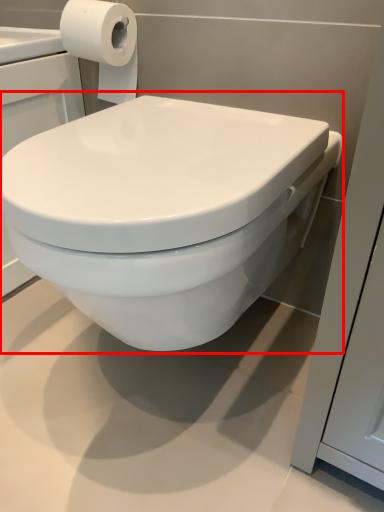
Question: From the image's perspective, what is the correct spatial relationship of toilet (annotated by the red box) in relation to toilet paper?

Choices:
 (A) above
 (B) below

Answer: (B)